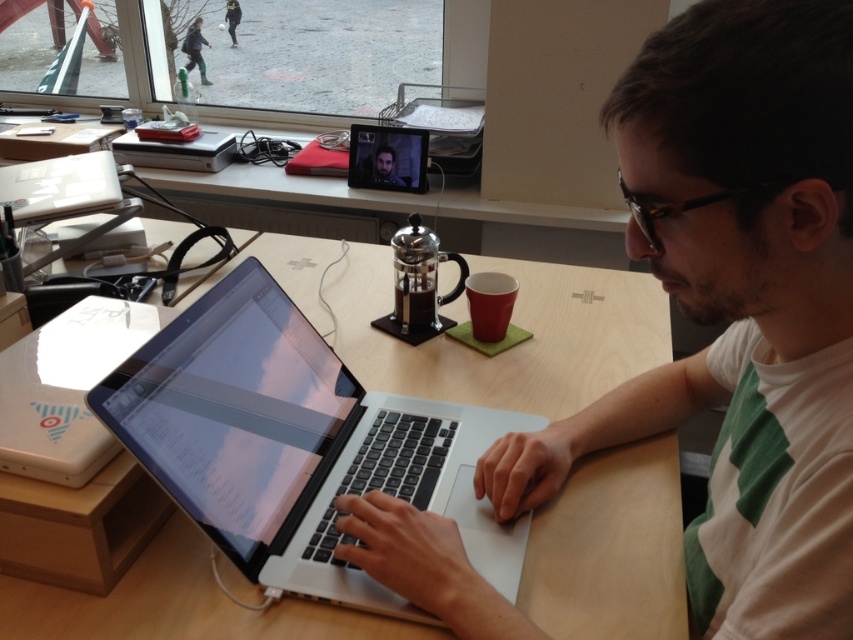
From the picture: Measure the distance between point (479,458) and camera.

They are 89.10 centimeters apart.

Where is `white cotton shirt at center`? The width and height of the screenshot is (853, 640). white cotton shirt at center is located at coordinates (737, 307).

What do you see at coordinates (297, 444) in the screenshot? The width and height of the screenshot is (853, 640). I see `sleek silver laptop at center` at bounding box center [297, 444].

Who is lower down, sleek silver laptop at center or white plastic laptop at center?

sleek silver laptop at center is below.

The height and width of the screenshot is (640, 853). What do you see at coordinates (297, 444) in the screenshot?
I see `sleek silver laptop at center` at bounding box center [297, 444].

Identify the location of sleek silver laptop at center. (297, 444).

Between white cotton shirt at center and sleek silver laptop at center, which one appears on the right side from the viewer's perspective?

white cotton shirt at center

Is point (708, 269) behind point (440, 468)?

No, it is in front of (440, 468).

Is point (724, 572) less distant than point (271, 579)?

That is True.

Where is `white cotton shirt at center`? white cotton shirt at center is located at coordinates (737, 307).